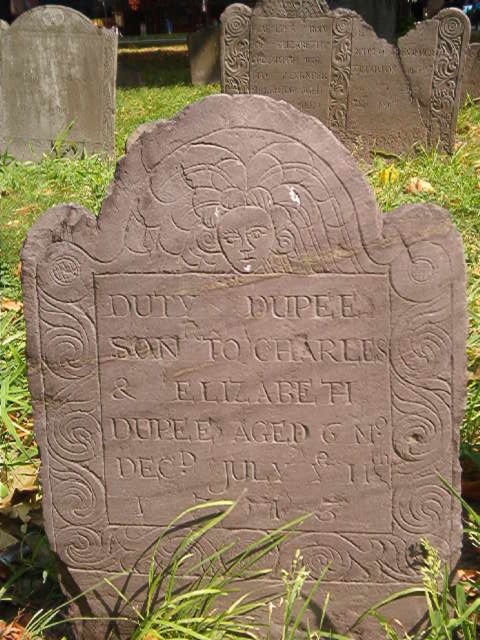
In the scene shown: You are standing at the entrance of the cemetery and want to locate the dark gray stone gravestone at upper center. According to the map, the entrance is at coordinate point 0.000, 0.000. What direction should you walk to reach the gravestone?

The dark gray stone gravestone at upper center is located at point (350, 70). Since the entrance is at (0, 0), you should walk towards the upper direction to reach it.

Based on the scene description provided, which object is located at the coordinates point (245, 387)?

The point (245, 387) corresponds to the black stone inscription at center.